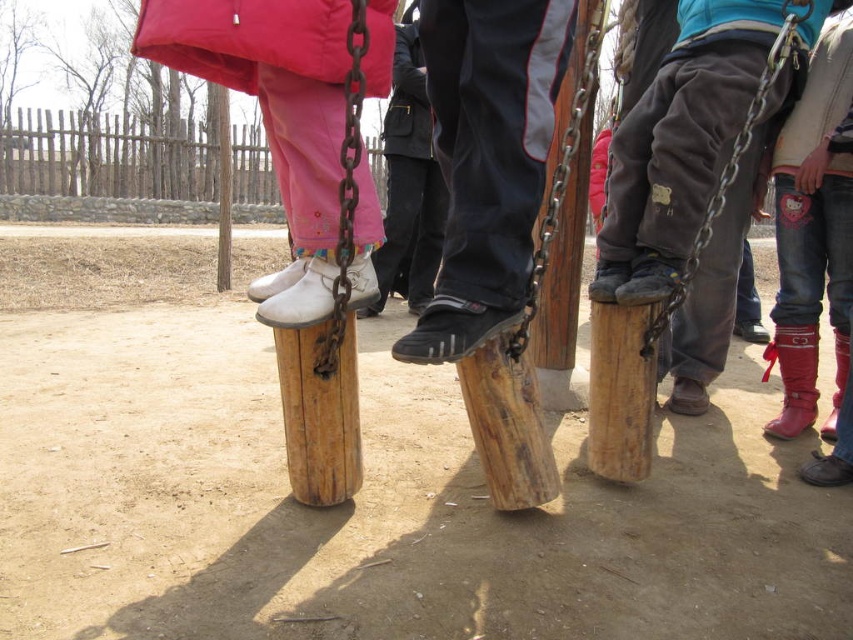
You are a photographer trying to capture a photo of the matte pink pants at left and the red leather boots at lower right. Which object is located to the left of the other?

The matte pink pants at left is positioned on the left side of red leather boots at lower right.

You are designing a layout for a photo shoot and need to ensure that the matte pink pants at left and the red leather boots at lower right are visible in the frame. Based on their sizes, which object should you prioritize placing closer to the camera to maintain visibility?

The matte pink pants at left occupies less space than red leather boots at lower right, so you should prioritize placing the matte pink pants at left closer to the camera to ensure it remains visible.

You are a photographer trying to capture a group photo of the matte pink pants at left and the red leather boots at lower right. The camera you are using has a maximum focus range of 1.5 meters. Will you be able to get both subjects in focus at the same time?

The matte pink pants at left is 1.47 meters from red leather boots at lower right. Since the distance between them is within the camera maximum focus range of 1.5 meters, both subjects can be captured in focus simultaneously.